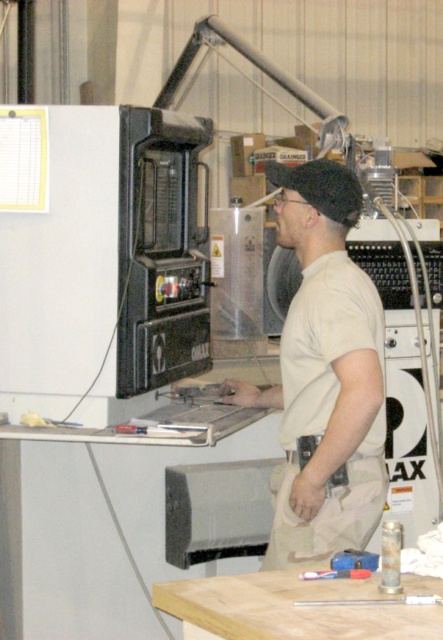
Which is above, beige cotton shirt at center or brushed metal screwdriver at center?

beige cotton shirt at center

Between beige cotton shirt at center and brushed metal screwdriver at center, which one appears on the left side from the viewer's perspective?

Positioned to the left is brushed metal screwdriver at center.

Who is more forward, (291, 481) or (364, 572)?

Point (364, 572)

The width and height of the screenshot is (443, 640). In order to click on beige cotton shirt at center in this screenshot , I will do `click(325, 374)`.

Does metallic blue tool at lower center appear on the left side of brushed metal screwdriver at center?

In fact, metallic blue tool at lower center is to the right of brushed metal screwdriver at center.

Between point (334, 570) and point (370, 572), which one is positioned behind?

Point (334, 570)

Does point (376, 561) come behind point (362, 577)?

Yes, point (376, 561) is behind point (362, 577).

Image resolution: width=443 pixels, height=640 pixels. I want to click on metallic blue tool at lower center, so click(x=353, y=561).

Is light brown wood at lower center wider than metallic blue tool at lower center?

Indeed, light brown wood at lower center has a greater width compared to metallic blue tool at lower center.

Is point (361, 588) less distant than point (364, 561)?

Yes.

Find the location of a particular element. light brown wood at lower center is located at coordinates (288, 609).